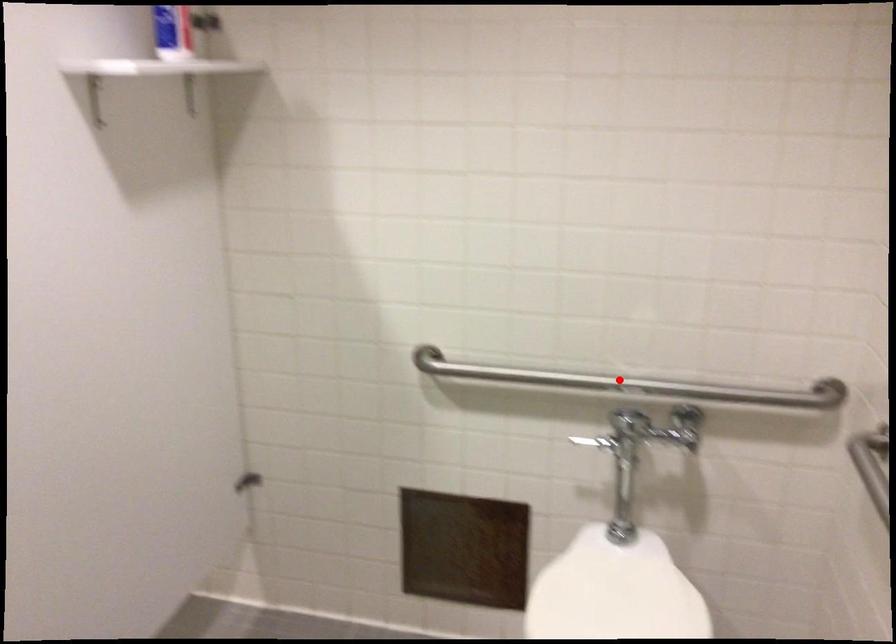
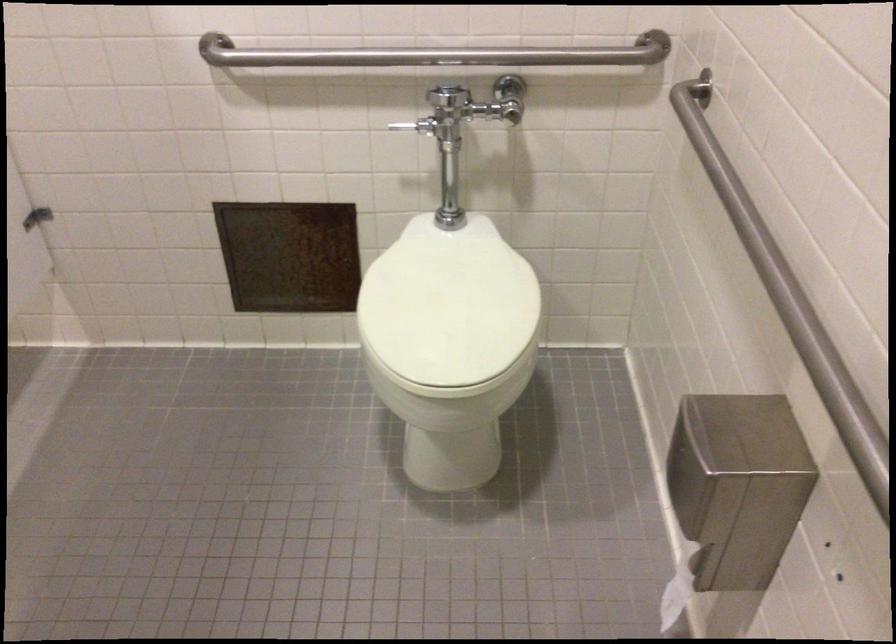
Find the pixel in the second image that matches the highlighted location in the first image.

(436, 55)